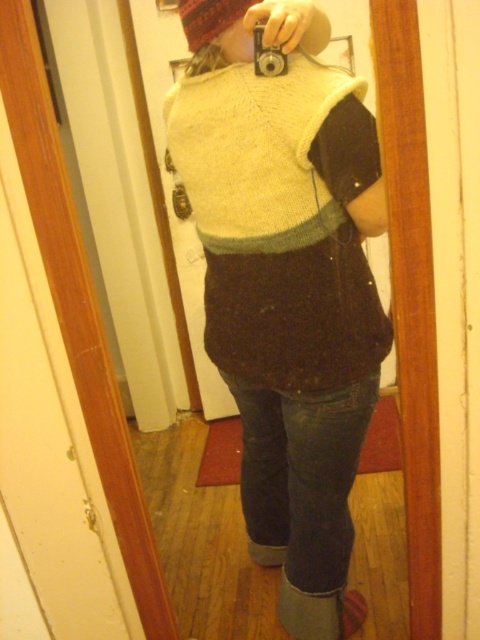
You are a fashion designer analyzing the outfit in the image. Which item of clothing is taller between the knitted sweater at center and the fuzzy woolen hat at upper center?

The knitted sweater at center is taller than the fuzzy woolen hat at upper center according to the description.

You are a photographer trying to capture a closeup shot of the knitted sweater at center and the silver metallic camera at upper center. Which object should you zoom in on more to ensure both are in focus?

The knitted sweater at center is bigger than the silver metallic camera at upper center, so you should zoom in more on the silver metallic camera at upper center to ensure both are in focus.